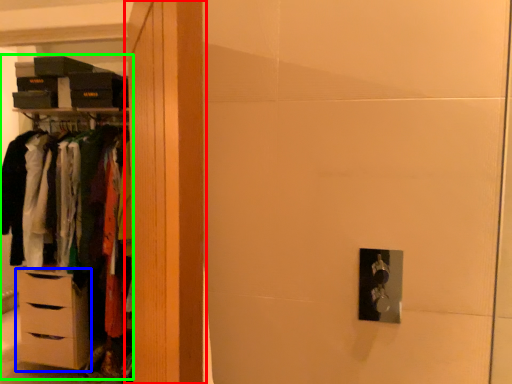
Question: Considering the real-world distances, which object is closest to armoire (highlighted by a red box)? chest of drawers (highlighted by a blue box) or dresser (highlighted by a green box).

Choices:
 (A) chest of drawers
 (B) dresser

Answer: (A)